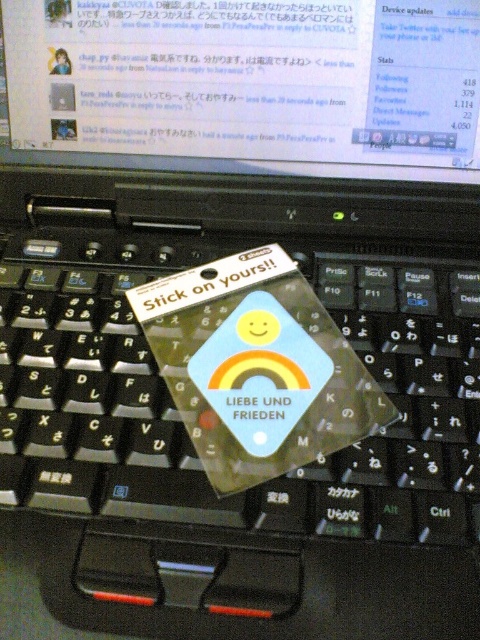
Question: Which is nearer to the matte plastic sticker at center?

Choices:
 (A) black plastic keyboard at center
 (B) matte plastic computer screen at upper center

Answer: (A)

Question: From the image, what is the correct spatial relationship of black plastic keyboard at center in relation to matte plastic sticker at center?

Choices:
 (A) right
 (B) left

Answer: (B)

Question: Is matte plastic computer screen at upper center bigger than matte plastic sticker at center?

Choices:
 (A) yes
 (B) no

Answer: (A)

Question: Can you confirm if matte plastic computer screen at upper center is thinner than matte plastic sticker at center?

Choices:
 (A) yes
 (B) no

Answer: (B)

Question: Which of these objects is positioned farthest from the matte plastic computer screen at upper center?

Choices:
 (A) black plastic keyboard at center
 (B) matte plastic sticker at center

Answer: (B)

Question: Which point is closer to the camera?

Choices:
 (A) black plastic keyboard at center
 (B) matte plastic computer screen at upper center

Answer: (A)